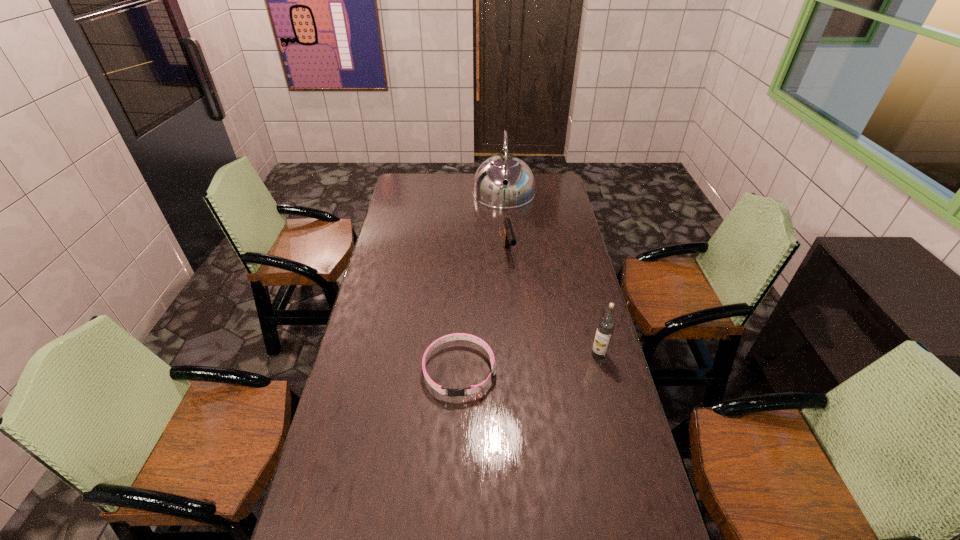
You are a GUI agent. You are given a task and a screenshot of the screen. Output one action in this format:
    pyautogui.click(x=<x>, y=<y>)
    Task: Click on the shortest object
    The width and height of the screenshot is (960, 540).
    Given the screenshot: What is the action you would take?
    pyautogui.click(x=452, y=392)

Where is `vodka`? The width and height of the screenshot is (960, 540). vodka is located at coordinates coord(606,325).

Locate an element on the screen. Image resolution: width=960 pixels, height=540 pixels. the rightmost object is located at coordinates coord(606,325).

You are a GUI agent. You are given a task and a screenshot of the screen. Output one action in this format:
    pyautogui.click(x=<x>, y=<y>)
    Task: Click on the pistol
    
    Given the screenshot: What is the action you would take?
    pyautogui.click(x=509, y=238)

The height and width of the screenshot is (540, 960). I want to click on the third nearest object, so click(509, 238).

Find the location of a particular element. Image resolution: width=960 pixels, height=540 pixels. kettle is located at coordinates (489, 189).

This screenshot has width=960, height=540. I want to click on the tallest object, so click(489, 189).

This screenshot has height=540, width=960. I want to click on vacant space situated with the buckle on the shortest object, so click(453, 526).

This screenshot has height=540, width=960. Find the location of `free space located 0.090m on the label of the rightmost object`. free space located 0.090m on the label of the rightmost object is located at coordinates (564, 355).

This screenshot has height=540, width=960. I want to click on vacant space located on the label of the rightmost object, so click(x=503, y=355).